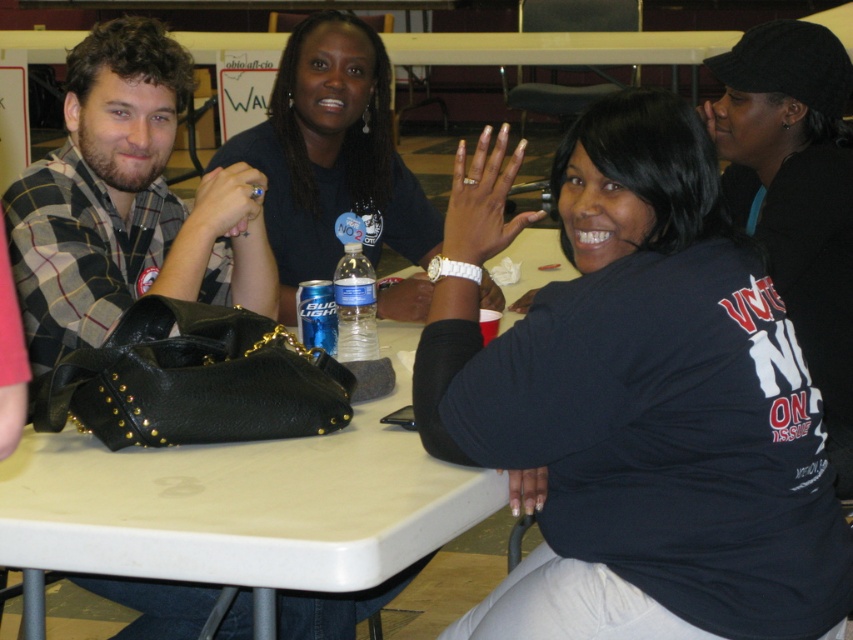
Between blue plastic water bottle at center and white acrylic nails at lower center, which one appears on the right side from the viewer's perspective?

white acrylic nails at lower center is more to the right.

The height and width of the screenshot is (640, 853). I want to click on blue plastic water bottle at center, so click(x=355, y=305).

At what (x,y) coordinates should I click in order to perform the action: click on blue plastic water bottle at center. Please return your answer as a coordinate pair (x, y). Looking at the image, I should click on (355, 305).

Does white matte ring at center come in front of white acrylic nails at lower center?

No, it is behind white acrylic nails at lower center.

Which is below, white matte ring at center or white acrylic nails at lower center?

white acrylic nails at lower center is lower down.

Between point (450, 202) and point (526, 468), which one is positioned in front?

Point (526, 468)

Image resolution: width=853 pixels, height=640 pixels. I want to click on white matte ring at center, so click(483, 200).

Which of these two, black fabric shirt at upper right or matte black shirt at center, stands shorter?

matte black shirt at center is shorter.

Is black fabric shirt at upper right above matte black shirt at center?

Actually, black fabric shirt at upper right is below matte black shirt at center.

Is point (683, 554) in front of point (339, 252)?

Yes, point (683, 554) is in front of point (339, 252).

Find the location of a particular element. The image size is (853, 640). black fabric shirt at upper right is located at coordinates (636, 397).